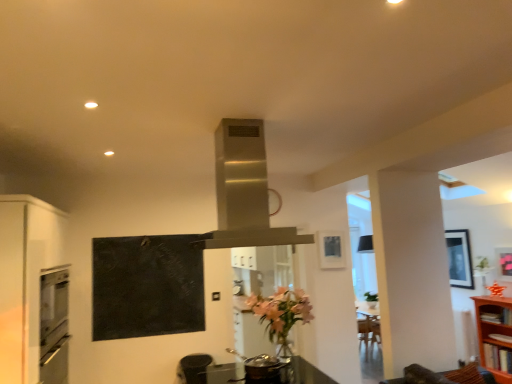
Question: Is stainless steel exhaust hood at center positioned in front of matte black picture frame at upper right, the 2th picture frame in the front-to-back sequence?

Choices:
 (A) yes
 (B) no

Answer: (A)

Question: Considering the relative sizes of stainless steel exhaust hood at center and matte black picture frame at upper right, acting as the 1th picture frame starting from the right, in the image provided, is stainless steel exhaust hood at center smaller than matte black picture frame at upper right, acting as the 1th picture frame starting from the right,?

Choices:
 (A) yes
 (B) no

Answer: (B)

Question: Is stainless steel exhaust hood at center further to camera compared to matte black picture frame at upper right, the second picture frame from the back?

Choices:
 (A) no
 (B) yes

Answer: (A)

Question: Is stainless steel exhaust hood at center beside matte black picture frame at upper right, positioned as the third picture frame in left-to-right order?

Choices:
 (A) yes
 (B) no

Answer: (B)

Question: From a real-world perspective, is stainless steel exhaust hood at center positioned under matte black picture frame at upper right, positioned as the third picture frame in left-to-right order, based on gravity?

Choices:
 (A) yes
 (B) no

Answer: (B)

Question: From the image's perspective, does stainless steel exhaust hood at center appear higher than matte black picture frame at upper right, the 2th picture frame in the front-to-back sequence?

Choices:
 (A) no
 (B) yes

Answer: (B)

Question: From the image's perspective, is stainless steel exhaust hood at center located beneath matte black trash can at lower center?

Choices:
 (A) yes
 (B) no

Answer: (B)

Question: Considering the relative sizes of stainless steel exhaust hood at center and matte black trash can at lower center in the image provided, is stainless steel exhaust hood at center smaller than matte black trash can at lower center?

Choices:
 (A) no
 (B) yes

Answer: (A)

Question: Can you confirm if stainless steel exhaust hood at center is positioned to the right of matte black trash can at lower center?

Choices:
 (A) no
 (B) yes

Answer: (B)

Question: Is the depth of stainless steel exhaust hood at center greater than that of matte black trash can at lower center?

Choices:
 (A) yes
 (B) no

Answer: (B)

Question: From a real-world perspective, is stainless steel exhaust hood at center physically below matte black trash can at lower center?

Choices:
 (A) yes
 (B) no

Answer: (B)

Question: Is stainless steel exhaust hood at center shorter than matte black trash can at lower center?

Choices:
 (A) yes
 (B) no

Answer: (B)

Question: Is brown wooden shelf at right, the 1th shelf from the top, touching wooden bookshelf at right, which ranks as the second shelf in top-to-bottom order?

Choices:
 (A) no
 (B) yes

Answer: (A)